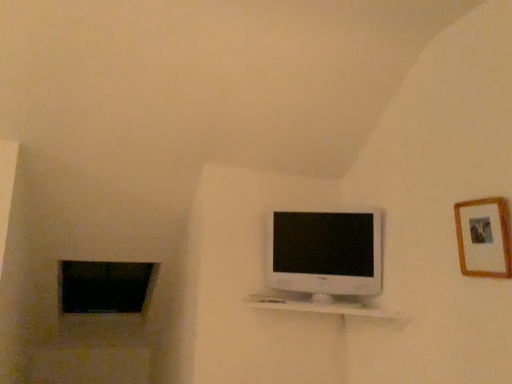
The width and height of the screenshot is (512, 384). Find the location of `white glossy shelf at center`. white glossy shelf at center is located at coordinates (324, 307).

I want to click on wooden picture frame at upper right, so click(x=484, y=237).

The width and height of the screenshot is (512, 384). Find the location of `black glass window at lower left`. black glass window at lower left is located at coordinates (105, 286).

What is the approximate width of white glossy television at center?

white glossy television at center is 5.07 inches wide.

Identify the location of white glossy shelf at center. 324,307.

Can you confirm if white glossy television at center is bigger than white glossy shelf at center?

Yes.

Can you confirm if white glossy television at center is shorter than white glossy shelf at center?

No, white glossy television at center is not shorter than white glossy shelf at center.

Are white glossy television at center and white glossy shelf at center making contact?

white glossy television at center is not next to white glossy shelf at center, and they're not touching.

Based on the photo, is white glossy television at center positioned before white glossy shelf at center?

No, white glossy television at center is further to the viewer.

Does white glossy television at center have a smaller size compared to wooden picture frame at upper right?

No, white glossy television at center is not smaller than wooden picture frame at upper right.

Where is `television on the left of wooden picture frame at upper right`? Image resolution: width=512 pixels, height=384 pixels. television on the left of wooden picture frame at upper right is located at coordinates (325, 253).

How different are the orientations of white glossy television at center and wooden picture frame at upper right in degrees?

The facing directions of white glossy television at center and wooden picture frame at upper right are 56.9 degrees apart.

Who is taller, white glossy television at center or wooden picture frame at upper right?

white glossy television at center.

Looking at the image, does wooden picture frame at upper right seem bigger or smaller compared to black glass window at lower left?

wooden picture frame at upper right is smaller than black glass window at lower left.

Which object is closer to the camera, wooden picture frame at upper right or black glass window at lower left?

wooden picture frame at upper right is in front.

From the image's perspective, which object appears higher, wooden picture frame at upper right or black glass window at lower left?

wooden picture frame at upper right, from the image's perspective.

This screenshot has width=512, height=384. I want to click on window below the wooden picture frame at upper right (from a real-world perspective), so click(x=105, y=286).

Considering the positions of points (499, 268) and (277, 298), is point (499, 268) closer to camera compared to point (277, 298)?

Yes, it is in front of point (277, 298).

Is wooden picture frame at upper right turned away from white glossy shelf at center?

wooden picture frame at upper right does not have its back to white glossy shelf at center.

Can you confirm if wooden picture frame at upper right is positioned to the right of white glossy shelf at center?

Indeed, wooden picture frame at upper right is positioned on the right side of white glossy shelf at center.

Is white glossy shelf at center positioned far away from black glass window at lower left?

white glossy shelf at center is far away from black glass window at lower left.

From the image's perspective, who appears lower, white glossy shelf at center or black glass window at lower left?

black glass window at lower left is shown below in the image.

Can black glass window at lower left be found inside white glossy shelf at center?

No, black glass window at lower left is not a part of white glossy shelf at center.

Can you confirm if white glossy shelf at center is thinner than black glass window at lower left?

Indeed, white glossy shelf at center has a lesser width compared to black glass window at lower left.

Which object is closer to the camera taking this photo, black glass window at lower left or white glossy shelf at center?

Positioned in front is white glossy shelf at center.

From a real-world perspective, is black glass window at lower left under white glossy shelf at center?

Yes.

Is point (151, 284) behind point (305, 307)?

Yes.

Is black glass window at lower left oriented towards white glossy shelf at center?

No, black glass window at lower left is not turned towards white glossy shelf at center.

From the image's perspective, which one is positioned higher, white glossy television at center or black glass window at lower left?

white glossy television at center.

Considering the positions of objects white glossy television at center and black glass window at lower left in the image provided, who is in front, white glossy television at center or black glass window at lower left?

Positioned in front is white glossy television at center.

Is white glossy television at center outside of black glass window at lower left?

Absolutely, white glossy television at center is external to black glass window at lower left.

Image resolution: width=512 pixels, height=384 pixels. Identify the location of television that is behind the white glossy shelf at center. (325, 253).

In order to click on television located below the wooden picture frame at upper right (from the image's perspective) in this screenshot , I will do `click(325, 253)`.

Estimate the real-world distances between objects in this image. Which object is further from white glossy shelf at center, white glossy television at center or wooden picture frame at upper right?

wooden picture frame at upper right lies further to white glossy shelf at center than the other object.

Which object lies further to the anchor point white glossy shelf at center, black glass window at lower left or wooden picture frame at upper right?

Based on the image, black glass window at lower left appears to be further to white glossy shelf at center.

Considering their positions, is black glass window at lower left positioned further to white glossy television at center than wooden picture frame at upper right?

black glass window at lower left is further to white glossy television at center.

Based on the photo, considering their positions, is white glossy shelf at center positioned closer to black glass window at lower left than wooden picture frame at upper right?

Based on the image, white glossy shelf at center appears to be nearer to black glass window at lower left.

Looking at the image, which one is located further to wooden picture frame at upper right, black glass window at lower left or white glossy television at center?

black glass window at lower left.

Considering their positions, is black glass window at lower left positioned further to white glossy television at center than white glossy shelf at center?

The object further to white glossy television at center is black glass window at lower left.

From the image, which object appears to be farther from white glossy shelf at center, wooden picture frame at upper right or white glossy television at center?

wooden picture frame at upper right is further to white glossy shelf at center.

From the image, which object appears to be nearer to black glass window at lower left, white glossy television at center or wooden picture frame at upper right?

Based on the image, white glossy television at center appears to be nearer to black glass window at lower left.

This screenshot has height=384, width=512. Identify the location of shelf located between black glass window at lower left and wooden picture frame at upper right in the left-right direction. (324, 307).

Identify the location of shelf between wooden picture frame at upper right and white glossy television at center in the front-back direction. The image size is (512, 384). (324, 307).

Image resolution: width=512 pixels, height=384 pixels. I want to click on television between black glass window at lower left and wooden picture frame at upper right in the horizontal direction, so click(325, 253).

Image resolution: width=512 pixels, height=384 pixels. What are the coordinates of `shelf between black glass window at lower left and white glossy television at center` in the screenshot? It's located at (324, 307).